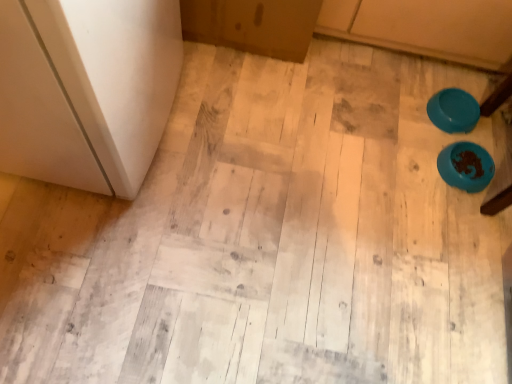
At what (x,y) coordinates should I click in order to perform the action: click on unoccupied space behind teal glossy bowl at upper right, which is the 2th bowl in bottom-to-top order. Please return your answer as a coordinate pair (x, y). The image size is (512, 384). Looking at the image, I should click on (448, 75).